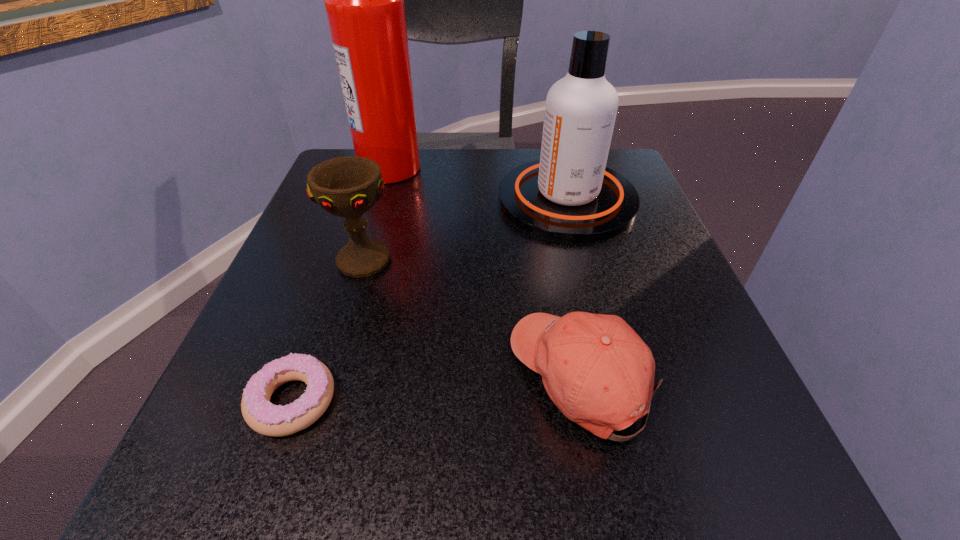
In order to click on free space between the cleansing agent and the third shortest object in this screenshot , I will do pyautogui.click(x=466, y=230).

The width and height of the screenshot is (960, 540). In order to click on free space between the second shortest object and the second tallest object in this screenshot , I will do `click(574, 288)`.

Identify the location of free space between the tallest object and the chalice. (377, 214).

The width and height of the screenshot is (960, 540). I want to click on vacant area that lies between the shortest object and the second shortest object, so click(x=437, y=389).

At what (x,y) coordinates should I click in order to perform the action: click on vacant region between the tallest object and the doughnut. Please return your answer as a coordinate pair (x, y). This screenshot has width=960, height=540. Looking at the image, I should click on (341, 284).

Where is `free space between the shortest object and the tallest object`? The image size is (960, 540). free space between the shortest object and the tallest object is located at coordinates (341, 284).

This screenshot has height=540, width=960. Find the location of `vacant area between the doughnut and the second shortest object`. vacant area between the doughnut and the second shortest object is located at coordinates (437, 389).

Find the location of a particular element. free area in between the third tallest object and the fourth tallest object is located at coordinates (472, 318).

At what (x,y) coordinates should I click in order to perform the action: click on free space between the fourth shortest object and the tallest object. Please return your answer as a coordinate pair (x, y). The width and height of the screenshot is (960, 540). Looking at the image, I should click on (479, 184).

Locate which object is the fourth closest to the fourth shortest object. Please provide its 2D coordinates. Your answer should be formatted as a tuple, i.e. [(x, y)], where the tuple contains the x and y coordinates of a point satisfying the conditions above.

[(260, 414)]